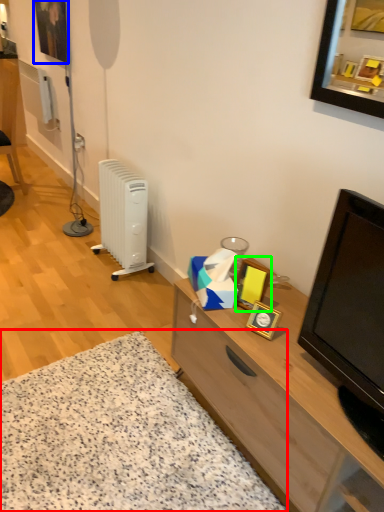
Question: Which object is the closest to the plain (highlighted by a red box)? Choose among these: picture frame (highlighted by a blue box) or picture frame (highlighted by a green box).

Choices:
 (A) picture frame
 (B) picture frame

Answer: (B)